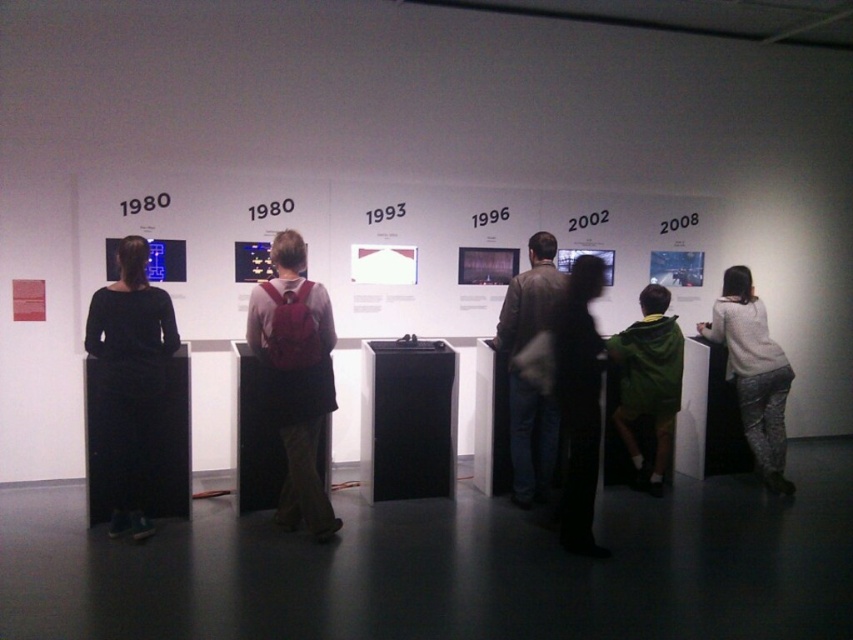
In the scene shown: You are a visitor at the exhibition and want to take a photo of both the black dress at left and the green hoodie at center. However, you can only focus on one object at a time. Which object should you focus on to ensure the other is still visible in the background?

You should focus on the black dress at left because it is positioned over the green hoodie at center, meaning the green hoodie at center will be in the background and still visible.

You are a visitor at the exhibition and notice two items in the center area. Which one is positioned to the left when looking at the matte red backpack at center and the dark fabric dress at center?

The matte red backpack at center is positioned to the left of the dark fabric dress at center.

You are a visitor at the exhibition and want to place your matte red backpack at center and dark fabric dress at center closer together so they don t get separated. How much space is between them?

The matte red backpack at center and dark fabric dress at center are 4.24 feet apart from each other.